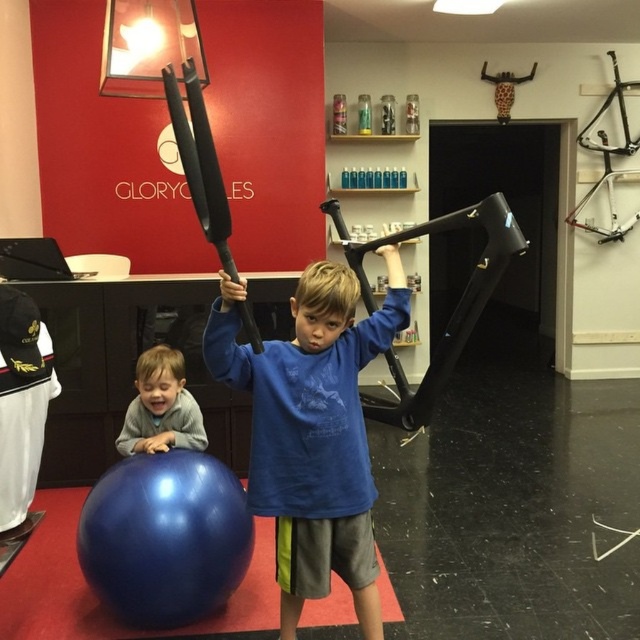
You are a fitness instructor observing two children in the gym. You notice the blue matte shirt at center and the blue rubber ball at lower left. Which object has a greater width when viewed from the front?

The blue rubber ball at lower left has a greater width when viewed from the front since it is thicker than the blue matte shirt at center.